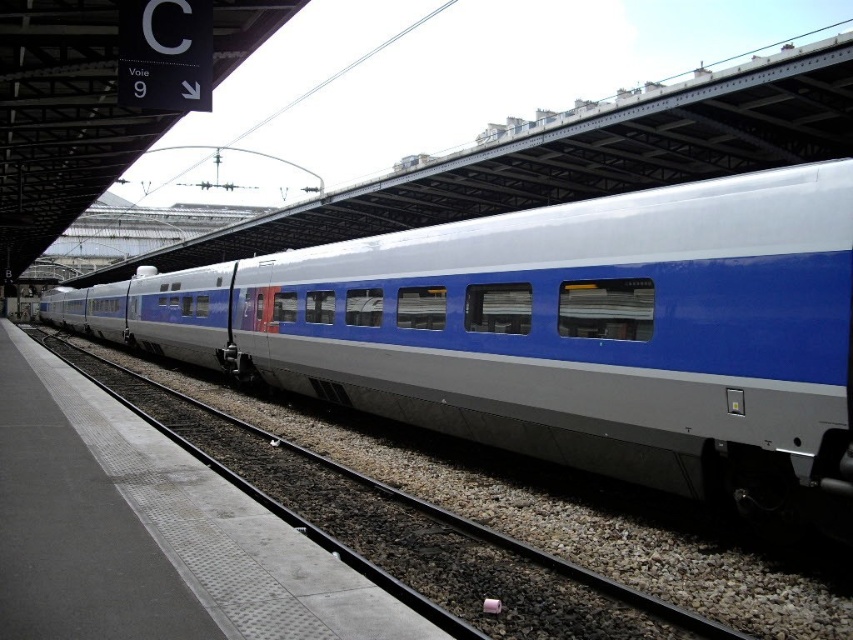
Does metallic blue train at center come in front of metallic gray track at center?

No, metallic blue train at center is behind metallic gray track at center.

Does metallic blue train at center have a lesser width compared to metallic gray track at center?

No, metallic blue train at center is not thinner than metallic gray track at center.

Is point (670, 484) in front of point (258, 461)?

That is True.

Locate an element on the screen. The image size is (853, 640). metallic blue train at center is located at coordinates (561, 333).